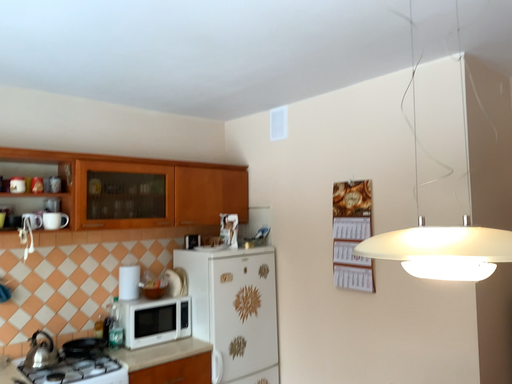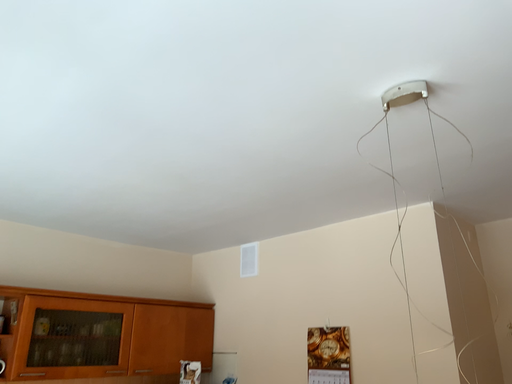
Question: How did the camera likely rotate when shooting the video?

Choices:
 (A) rotated upward
 (B) rotated downward

Answer: (A)